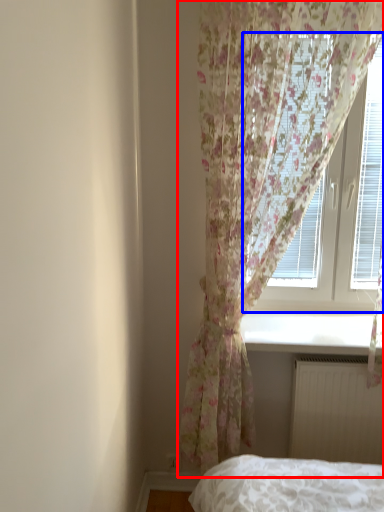
Question: Which point is further to the camera, curtain (highlighted by a red box) or window (highlighted by a blue box)?

Choices:
 (A) curtain
 (B) window

Answer: (B)